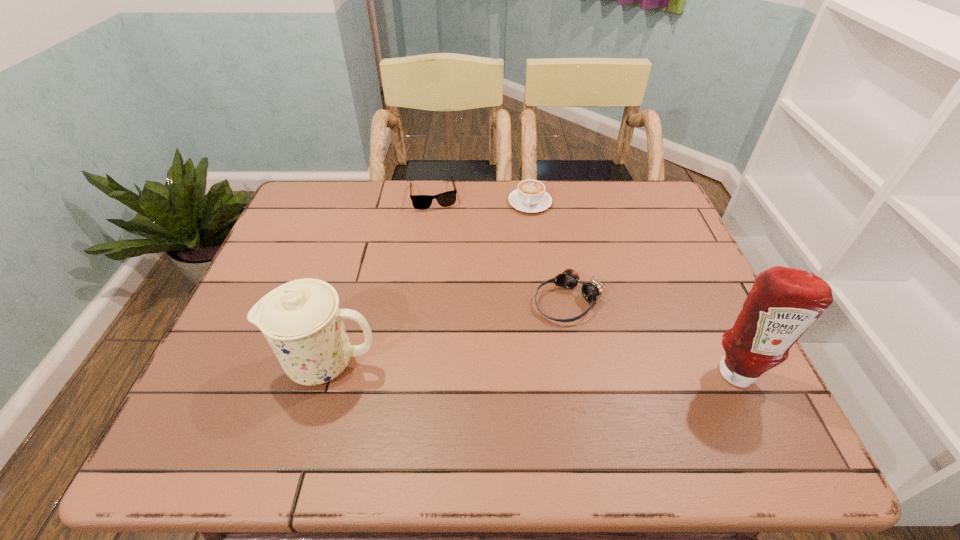
Where is `chinaware that is positioned at the near edge`? chinaware that is positioned at the near edge is located at coordinates (301, 320).

Identify the location of condiment that is at the near edge. (783, 303).

Find the location of a particular element. The width and height of the screenshot is (960, 540). object that is at the left edge is located at coordinates (301, 320).

Identify the location of object that is at the right edge. (783, 303).

The height and width of the screenshot is (540, 960). What are the coordinates of `object that is positioned at the near left corner` in the screenshot? It's located at (301, 320).

Locate an element on the screen. The width and height of the screenshot is (960, 540). object that is at the near right corner is located at coordinates (783, 303).

In order to click on vacant space at the far edge in this screenshot , I will do `click(481, 190)`.

Identify the location of vacant space at the near edge. The image size is (960, 540). (293, 387).

In the image, there is a desktop. In order to click on vacant space at the left edge in this screenshot , I will do `click(332, 232)`.

In the image, there is a desktop. Identify the location of vacant space at the right edge. (673, 333).